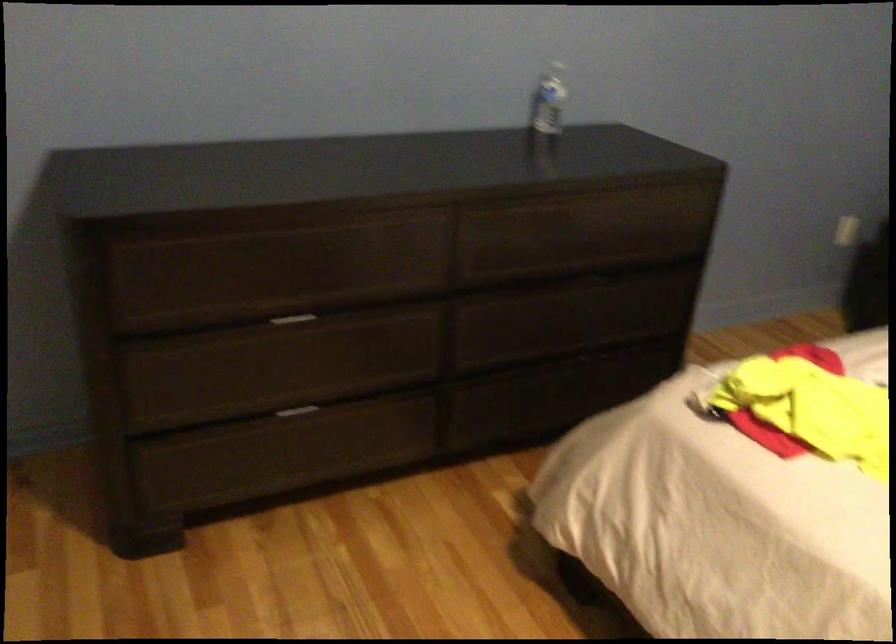
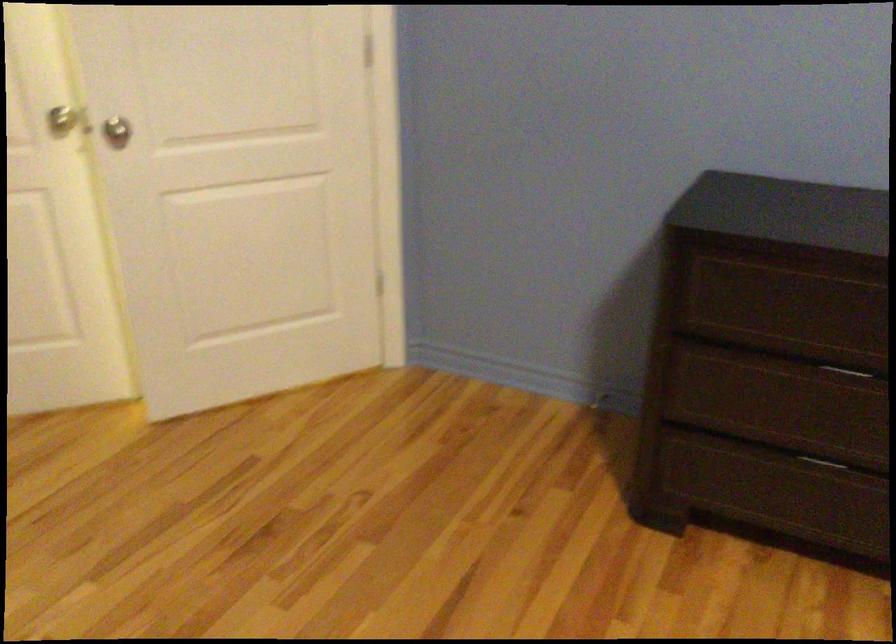
Question: The camera is either moving clockwise (left) or counter-clockwise (right) around the object. The first image is from the beginning of the video and the second image is from the end. Is the camera moving left or right when shooting the video?

Choices:
 (A) Left
 (B) Right

Answer: (B)